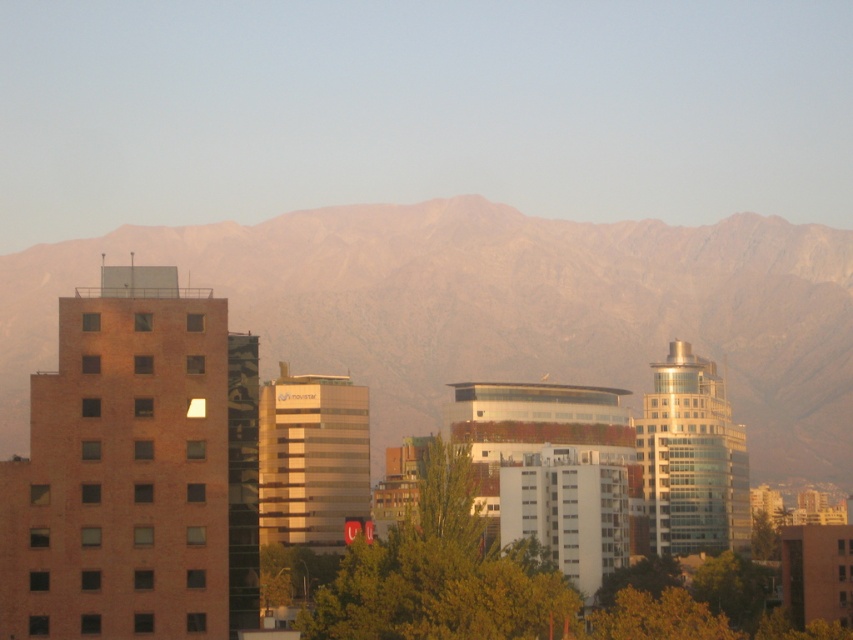
Question: Is rocky brown mountain range at upper center closer to the viewer compared to green leafy tree at center?

Choices:
 (A) yes
 (B) no

Answer: (A)

Question: Can you confirm if rocky brown mountain range at upper center is positioned to the left of green leafy tree at center?

Choices:
 (A) no
 (B) yes

Answer: (B)

Question: Among these points, which one is farthest from the camera?

Choices:
 (A) (378, 632)
 (B) (822, 244)

Answer: (B)

Question: Which of the following is the closest to the observer?

Choices:
 (A) (397, 624)
 (B) (764, 376)

Answer: (A)

Question: Does rocky brown mountain range at upper center lie behind green leafy tree at center?

Choices:
 (A) yes
 (B) no

Answer: (B)